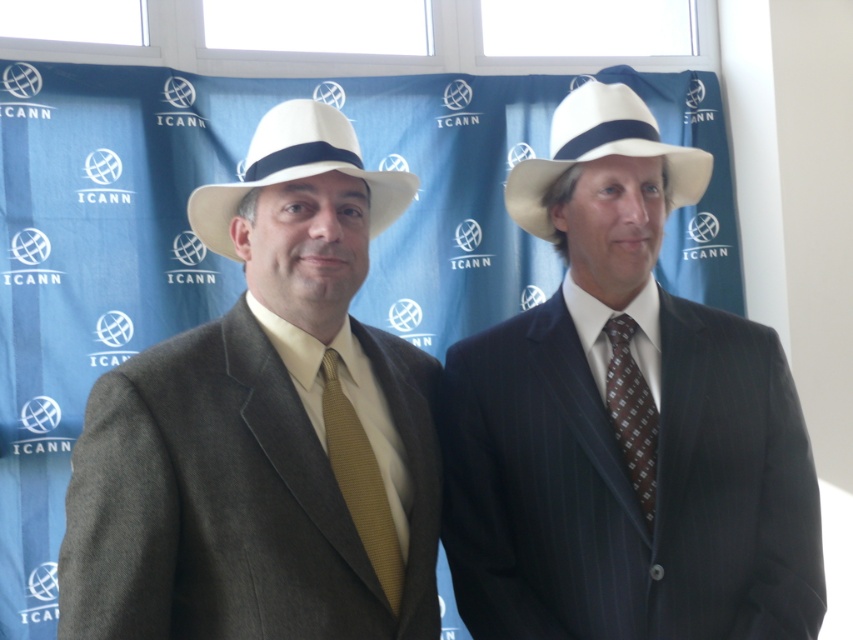
Question: Which is nearer to the white felt fedora at center?

Choices:
 (A) brown woven tie at center
 (B) matte black suit at center
 (C) gold textured tie at center

Answer: (C)

Question: Does white felt fedora at center have a smaller size compared to brown woven tie at center?

Choices:
 (A) yes
 (B) no

Answer: (B)

Question: Estimate the real-world distances between objects in this image. Which object is farther from the white felt fedora at center?

Choices:
 (A) matte black suit at center
 (B) brown woven tie at center

Answer: (B)

Question: Which point is closer to the camera?

Choices:
 (A) (368, 548)
 (B) (567, 109)

Answer: (A)

Question: Can you confirm if matte brown suit at center is positioned above gold textured tie at center?

Choices:
 (A) no
 (B) yes

Answer: (B)

Question: Does matte brown suit at center have a greater width compared to white felt fedora at upper right?

Choices:
 (A) no
 (B) yes

Answer: (B)